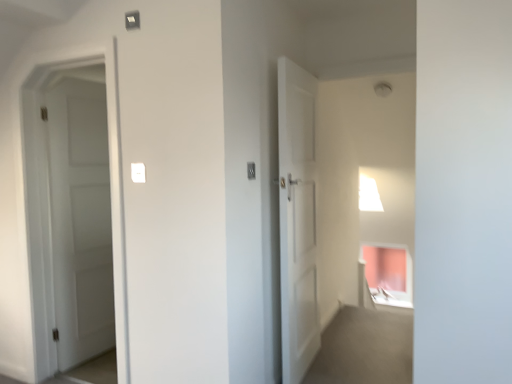
Question: From a real-world perspective, is white matte door at left on top of white plastic light switch at center, the second light switch when ordered from right to left?

Choices:
 (A) yes
 (B) no

Answer: (B)

Question: Considering the relative positions of white matte door at left and white plastic light switch at center, the second light switch when ordered from right to left, in the image provided, is white matte door at left behind white plastic light switch at center, the second light switch when ordered from right to left,?

Choices:
 (A) yes
 (B) no

Answer: (A)

Question: Is white matte door at left located outside white plastic light switch at center, the 1th light switch positioned from the left?

Choices:
 (A) no
 (B) yes

Answer: (B)

Question: Does white matte door at left have a greater width compared to white plastic light switch at center, the 1th light switch positioned from the left?

Choices:
 (A) yes
 (B) no

Answer: (A)

Question: Is white matte door at left thinner than white plastic light switch at center, the second light switch when ordered from right to left?

Choices:
 (A) no
 (B) yes

Answer: (A)

Question: From a real-world perspective, is white matte door at left physically located above or below white plastic light switch at center, marked as the 1th light switch in a right-to-left arrangement?

Choices:
 (A) below
 (B) above

Answer: (A)

Question: Is white matte door at left bigger or smaller than white plastic light switch at center, marked as the 1th light switch in a right-to-left arrangement?

Choices:
 (A) big
 (B) small

Answer: (A)

Question: Is point (76, 132) positioned closer to the camera than point (252, 170)?

Choices:
 (A) farther
 (B) closer

Answer: (A)

Question: From the image's perspective, is white matte door at left located above or below white plastic light switch at center, marked as the 1th light switch in a right-to-left arrangement?

Choices:
 (A) below
 (B) above

Answer: (A)

Question: From the image's perspective, is white plastic light switch at center, marked as the 1th light switch in a right-to-left arrangement, positioned above or below white matte door at left?

Choices:
 (A) above
 (B) below

Answer: (A)

Question: In terms of width, does white plastic light switch at center, marked as the 1th light switch in a right-to-left arrangement, look wider or thinner when compared to white matte door at left?

Choices:
 (A) thin
 (B) wide

Answer: (A)

Question: Considering their positions, is white plastic light switch at center, the second light switch when ordered from left to right, located in front of or behind white matte door at left?

Choices:
 (A) front
 (B) behind

Answer: (A)

Question: Is white plastic light switch at center, marked as the 1th light switch in a right-to-left arrangement, spatially inside white matte door at left, or outside of it?

Choices:
 (A) outside
 (B) inside

Answer: (A)

Question: Considering the positions of white plastic light switch at center, the 1th light switch positioned from the left, and white matte door at left in the image, is white plastic light switch at center, the 1th light switch positioned from the left, wider or thinner than white matte door at left?

Choices:
 (A) wide
 (B) thin

Answer: (B)

Question: In terms of height, does white plastic light switch at center, the second light switch when ordered from right to left, look taller or shorter compared to white matte door at left?

Choices:
 (A) tall
 (B) short

Answer: (B)